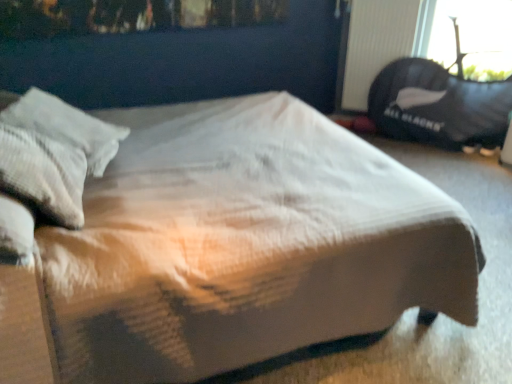
Question: Based on their sizes in the image, would you say black plastic radiator at upper right is bigger or smaller than black fabric bean bag at upper right?

Choices:
 (A) big
 (B) small

Answer: (B)

Question: Is black plastic radiator at upper right taller or shorter than black fabric bean bag at upper right?

Choices:
 (A) short
 (B) tall

Answer: (A)

Question: Which object is the farthest from the gray textured pillow at left?

Choices:
 (A) white quilted fabric bed at center
 (B) black fabric bean bag at upper right
 (C) black plastic radiator at upper right

Answer: (B)

Question: Considering the real-world distances, which object is closest to the gray textured pillow at left?

Choices:
 (A) white quilted fabric bed at center
 (B) black plastic radiator at upper right
 (C) black fabric bean bag at upper right

Answer: (A)